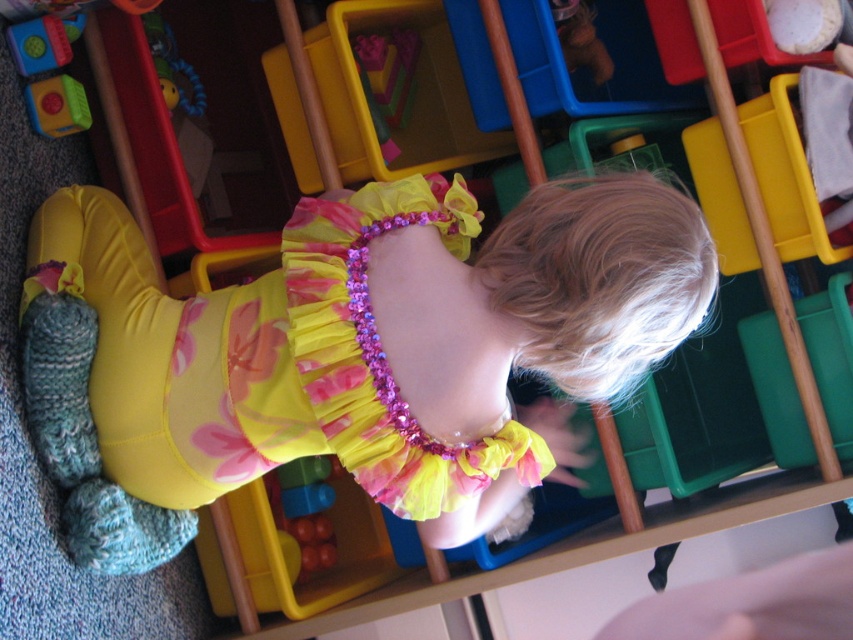
Question: Is translucent plastic blocks at lower center further to the viewer compared to rubberized green toy at upper left?

Choices:
 (A) no
 (B) yes

Answer: (B)

Question: Which object is the farthest from the rubberized green toy at upper left?

Choices:
 (A) translucent plastic blocks at lower center
 (B) yellow satin dress at center

Answer: (A)

Question: Does yellow satin dress at center appear on the left side of translucent plastic blocks at lower center?

Choices:
 (A) yes
 (B) no

Answer: (B)

Question: Among these points, which one is farthest from the camera?

Choices:
 (A) (328, 548)
 (B) (47, 90)

Answer: (A)

Question: Which point is closer to the camera?

Choices:
 (A) rubberized green toy at upper left
 (B) yellow satin dress at center

Answer: (B)

Question: In this image, where is translucent plastic blocks at lower center located relative to rubberized green toy at upper left?

Choices:
 (A) below
 (B) above

Answer: (A)